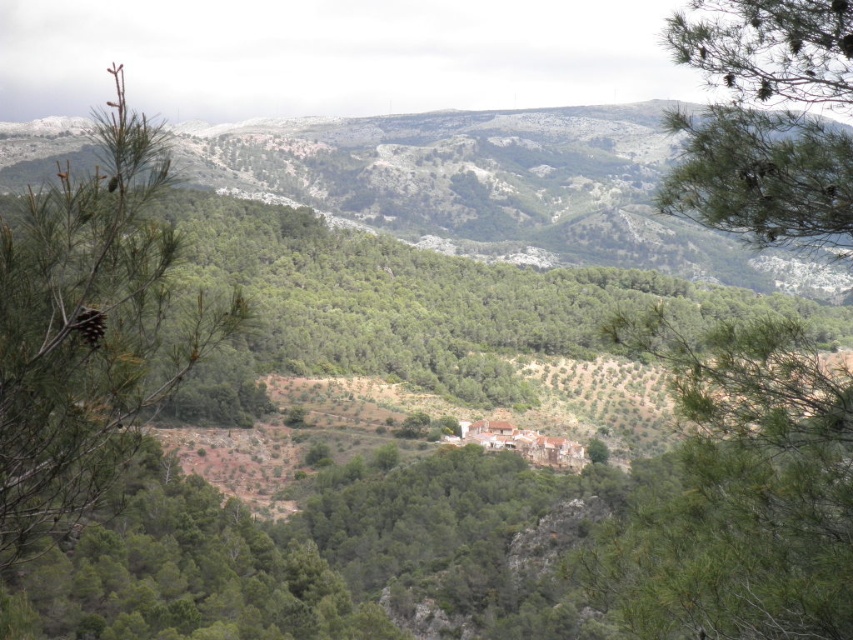
You are a hiker planning to take a photo of the green textured hillside at upper center and the green leafy tree at center. Which object will occupy more horizontal space in your photo?

The green textured hillside at upper center will occupy more horizontal space in the photo because its width surpasses that of the green leafy tree at center.